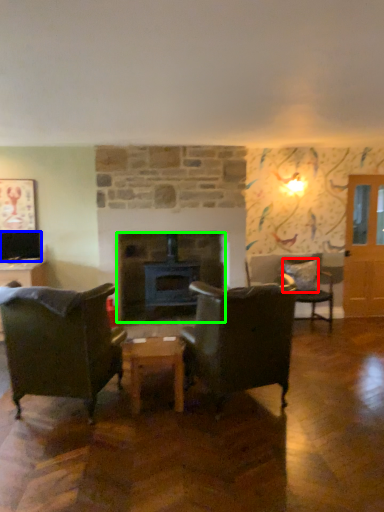
Question: Based on their relative distances, which object is farther from pillow (highlighted by a red box)? Choose from television (highlighted by a blue box) and fireplace (highlighted by a green box).

Choices:
 (A) television
 (B) fireplace

Answer: (A)